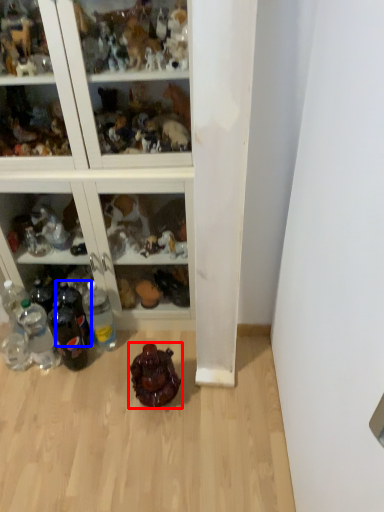
Question: Which point is further to the camera, toy (highlighted by a red box) or bottle (highlighted by a blue box)?

Choices:
 (A) toy
 (B) bottle

Answer: (B)